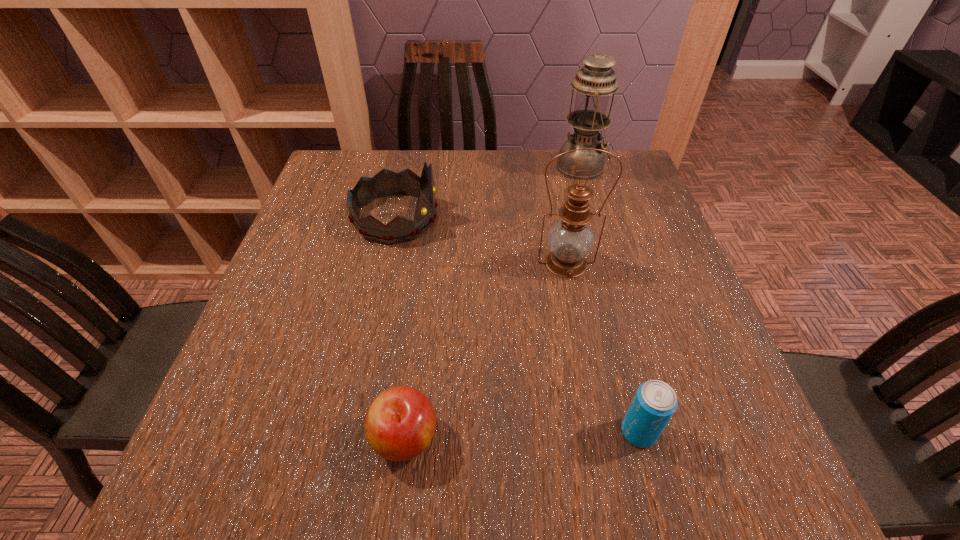
Find the location of a particular element. Image resolution: width=960 pixels, height=540 pixels. free spot between the second shortest object and the apple is located at coordinates (521, 435).

Image resolution: width=960 pixels, height=540 pixels. What are the coordinates of `free point between the soda can and the shortest object` in the screenshot? It's located at tap(521, 435).

This screenshot has height=540, width=960. I want to click on free space between the nearer oil lamp and the tiara, so click(x=481, y=240).

At what (x,y) coordinates should I click in order to perform the action: click on blank region between the farthest object and the shortest object. Please return your answer as a coordinate pair (x, y). This screenshot has height=540, width=960. Looking at the image, I should click on (493, 302).

Image resolution: width=960 pixels, height=540 pixels. Identify the location of free spot between the nearer oil lamp and the soda can. click(603, 347).

Locate an element on the screen. Image resolution: width=960 pixels, height=540 pixels. free space between the tiara and the shortest object is located at coordinates (400, 328).

Identify the location of free space between the nearer oil lamp and the soda can. The width and height of the screenshot is (960, 540). (603, 347).

Where is `the closest object relative to the nearer oil lamp`? the closest object relative to the nearer oil lamp is located at coordinates (385, 183).

Image resolution: width=960 pixels, height=540 pixels. I want to click on the second closest object to the apple, so click(x=571, y=239).

At what (x,y) coordinates should I click in order to perform the action: click on blank area in the image that satisfies the following two spatial constraints: 1. at the front of the third nearest object with jewels; 2. on the left side of the third tallest object. Please return your answer as a coordinate pair (x, y). This screenshot has width=960, height=540. Looking at the image, I should click on (386, 263).